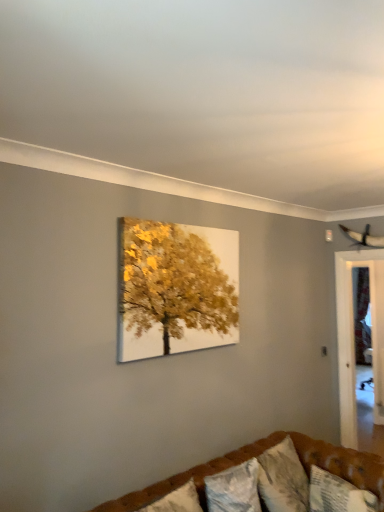
Question: From a real-world perspective, is brown tufted couch at lower center physically located above or below textured white pillow at lower right, which appears as the first pillow when viewed from the right?

Choices:
 (A) above
 (B) below

Answer: (B)

Question: Based on their positions, is brown tufted couch at lower center located to the left or right of textured white pillow at lower right, which appears as the first pillow when viewed from the right?

Choices:
 (A) right
 (B) left

Answer: (B)

Question: Based on their relative distances, which object is nearer to the brown tufted couch at lower center?

Choices:
 (A) textured white pillow at lower right, the 2th pillow viewed from the left
 (B) textured white pillow at lower center, arranged as the 2th pillow when viewed from the right
 (C) transparent glass door at right

Answer: (B)

Question: Which object is positioned closest to the brown tufted couch at lower center?

Choices:
 (A) textured white pillow at lower center, arranged as the 2th pillow when viewed from the right
 (B) textured white pillow at lower right, which appears as the first pillow when viewed from the right
 (C) transparent glass door at right

Answer: (A)